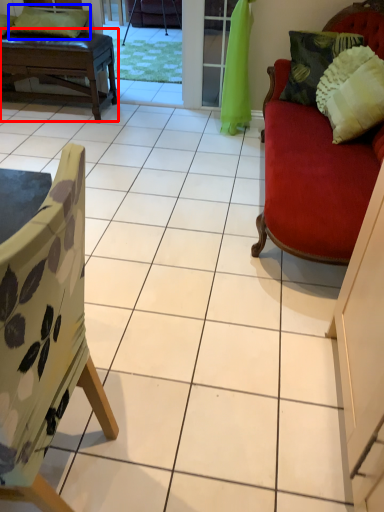
Question: Which of the following is the farthest to the observer, table (highlighted by a red box) or pillow (highlighted by a blue box)?

Choices:
 (A) table
 (B) pillow

Answer: (B)